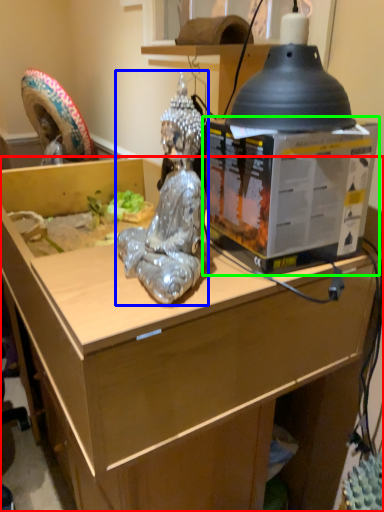
Question: Which is farther away from desk (highlighted by a red box)? person (highlighted by a blue box) or box (highlighted by a green box)?

Choices:
 (A) person
 (B) box

Answer: (A)